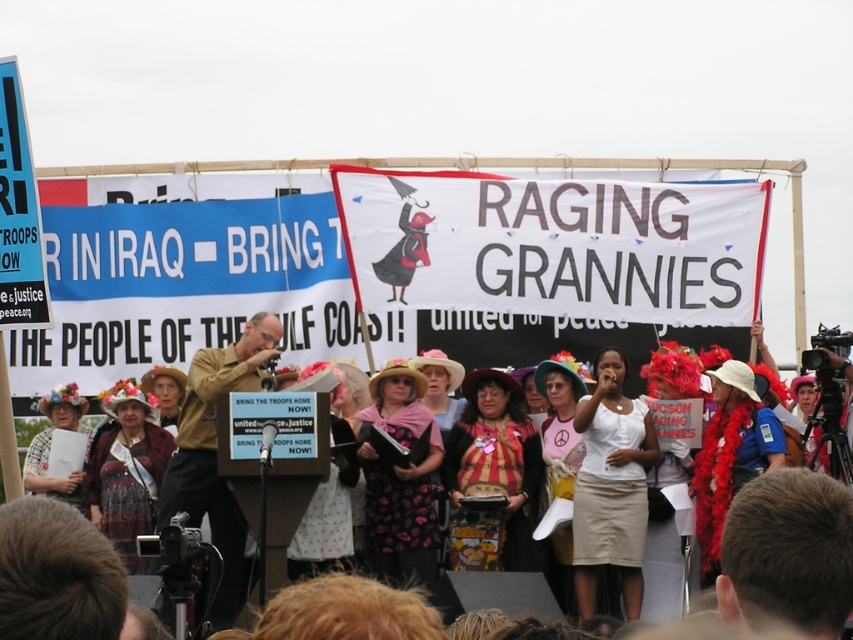
Question: Does white floral dress at center appear over pink fabric shirt at center?

Choices:
 (A) no
 (B) yes

Answer: (B)

Question: Among these points, which one is farthest from the camera?

Choices:
 (A) 750,467
 (B) 646,440

Answer: (B)

Question: Based on their relative distances, which object is nearer to the floral fabric dress at lower left?

Choices:
 (A) floral-patterned dress at center
 (B) striped fabric dress at center
 (C) matte brown jacket at center
 (D) white fabric skirt at center

Answer: (A)

Question: Is striped fabric dress at center positioned behind matte brown jacket at center?

Choices:
 (A) yes
 (B) no

Answer: (A)

Question: Which of the following is the farthest from the observer?

Choices:
 (A) pink fabric shirt at center
 (B) matte brown jacket at center
 (C) floral fabric dress at lower left
 (D) floral fabric dress at center

Answer: (C)

Question: Does white fabric skirt at center appear on the left side of floral fabric dress at center?

Choices:
 (A) no
 (B) yes

Answer: (A)